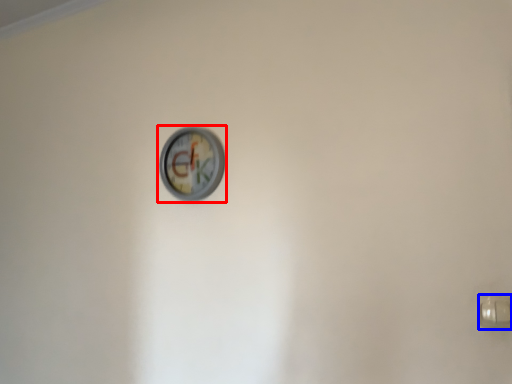
Question: Which object appears closest to the camera in this image, wall clock (highlighted by a red box) or door handle (highlighted by a blue box)?

Choices:
 (A) wall clock
 (B) door handle

Answer: (B)